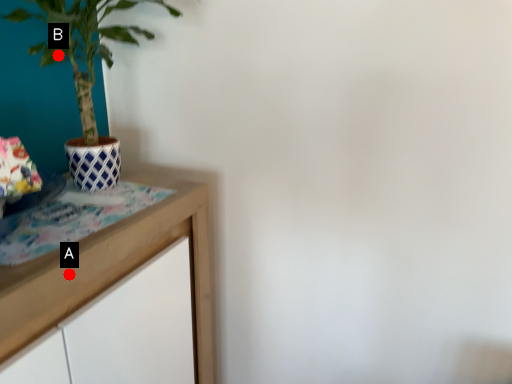
Question: Two points are circled on the image, labeled by A and B beside each circle. Among these points, which one is nearest to the camera?

Choices:
 (A) A is closer
 (B) B is closer

Answer: (A)